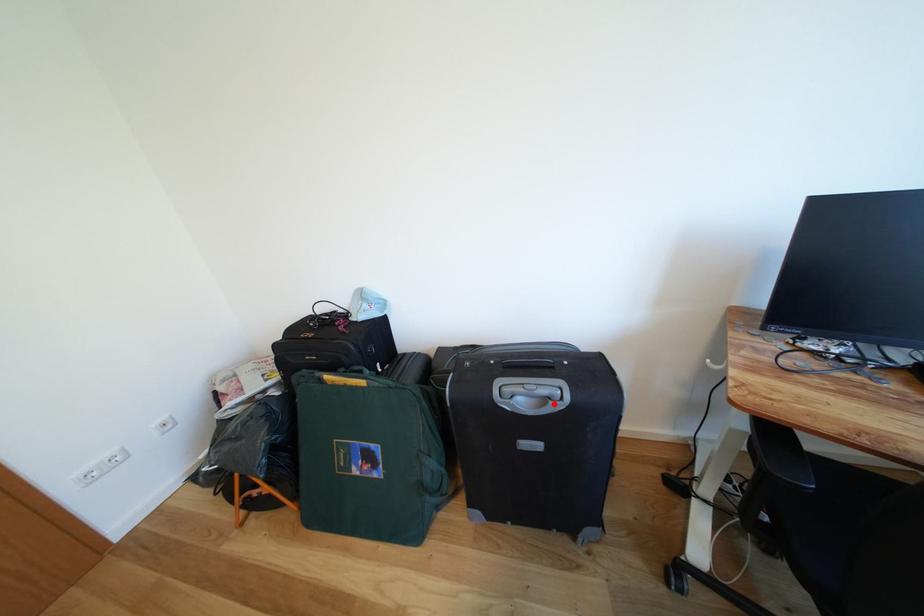
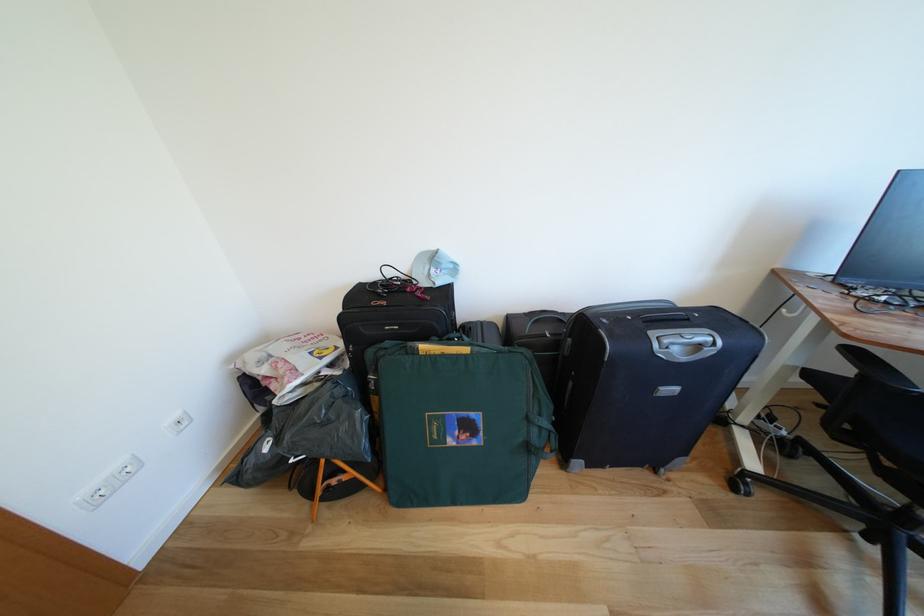
In the second image, find the point that corresponds to the highlighted location in the first image.

(707, 351)